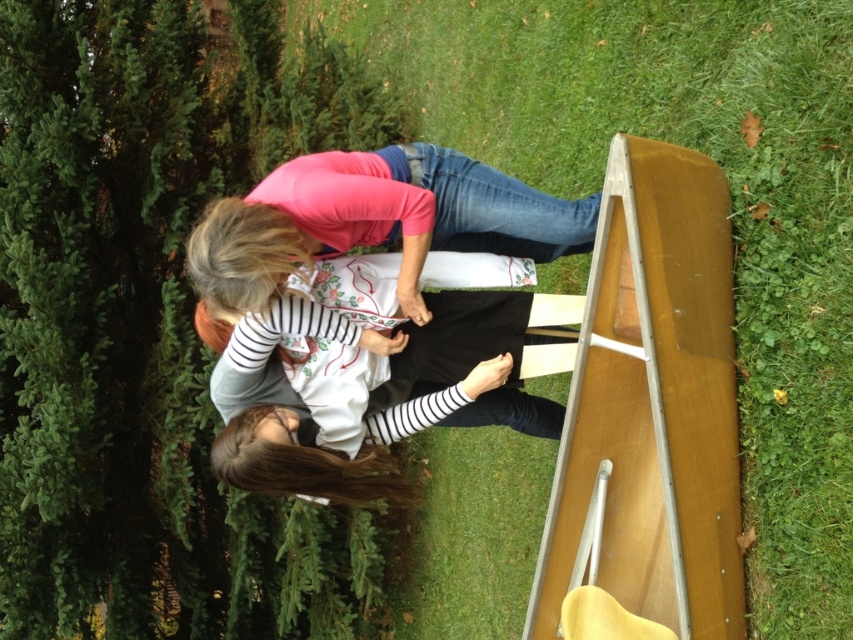
Looking at this image, you are standing at the edge of the grassy area in the scene and want to place a small potted plant 2 meters away from where you are standing. Can you place it on the green grass at lower right?

The green grass at lower right is 2.26 meters away from the viewer, so placing the potted plant 2 meters away from your current position would place it just before reaching the green grass at lower right. Therefore, the potted plant cannot be placed directly on the green grass at lower right as it is slightly farther than 2 meters.

In the scene shown: You are standing in the scene and want to place a 3.5 feet long object on the ground near the green grass at lower right. Is there enough space for it?

The green grass at lower right is 7.43 feet away from the viewer, so there is sufficient space to place a 3.5 feet long object near it.